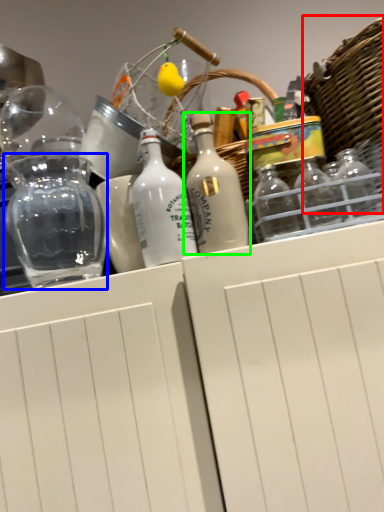
Question: Considering the real-world distances, which object is closest to basket (highlighted by a red box)? glass jar (highlighted by a blue box) or bottle (highlighted by a green box).

Choices:
 (A) glass jar
 (B) bottle

Answer: (B)